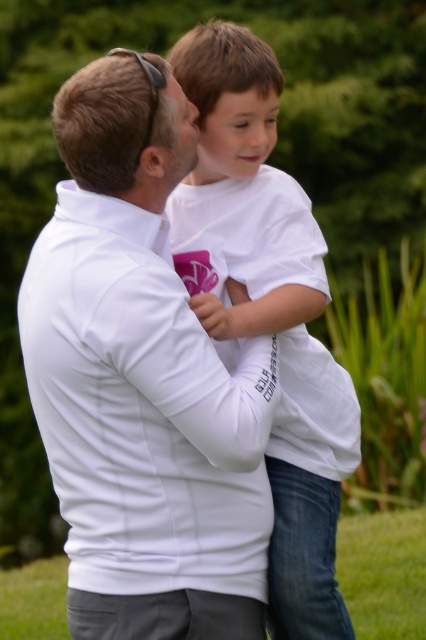
Who is more forward, (74, 330) or (178, 170)?

Point (74, 330)

The height and width of the screenshot is (640, 426). Identify the location of white matte jacket at center. (x=141, y=388).

Which is below, white matte shirt at center or smooth white face at center?

white matte shirt at center is lower down.

Is white matte shirt at center thinner than smooth white face at center?

No, white matte shirt at center is not thinner than smooth white face at center.

Does point (275, 588) come closer to viewer compared to point (267, 109)?

That is False.

Locate an element on the screen. The image size is (426, 640). white matte shirt at center is located at coordinates (267, 308).

Is white matte jacket at center positioned before white matte shirt at center?

Yes.

What do you see at coordinates (141, 388) in the screenshot?
I see `white matte jacket at center` at bounding box center [141, 388].

Identify the location of white matte jacket at center. Image resolution: width=426 pixels, height=640 pixels. (141, 388).